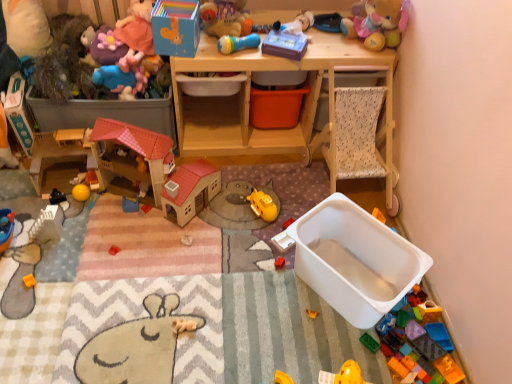
Where is `vacant area that is in front of yellow rubber ball at center-left, which is the 11th toy from right to left`? Image resolution: width=512 pixels, height=384 pixels. vacant area that is in front of yellow rubber ball at center-left, which is the 11th toy from right to left is located at coordinates (71, 228).